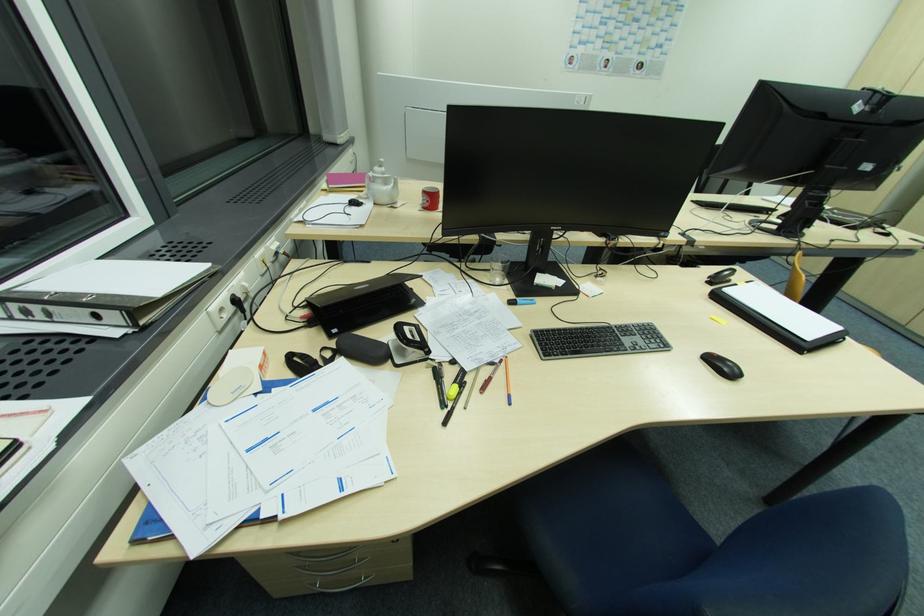
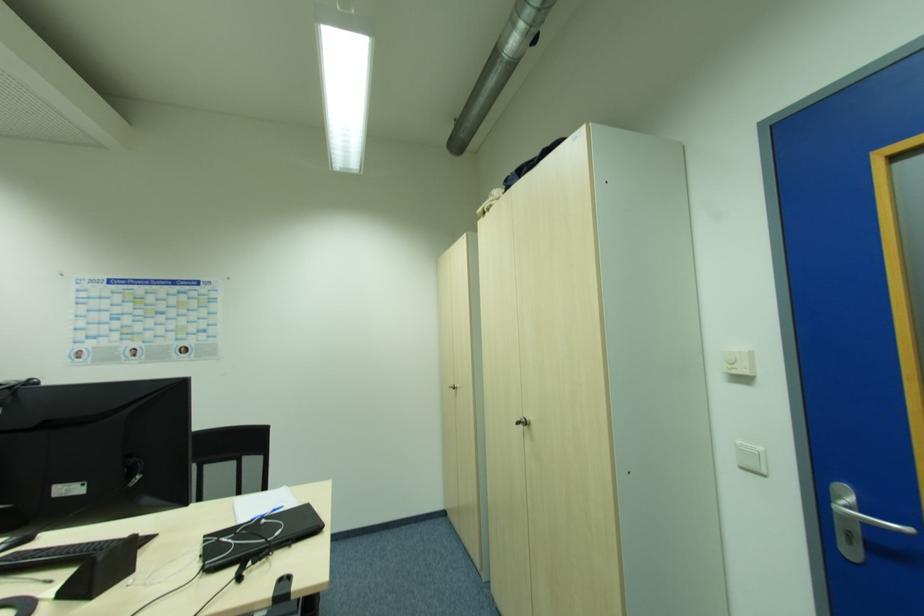
The point at (x=837, y=213) is marked in the first image. Where is the corresponding point in the second image?

(265, 521)